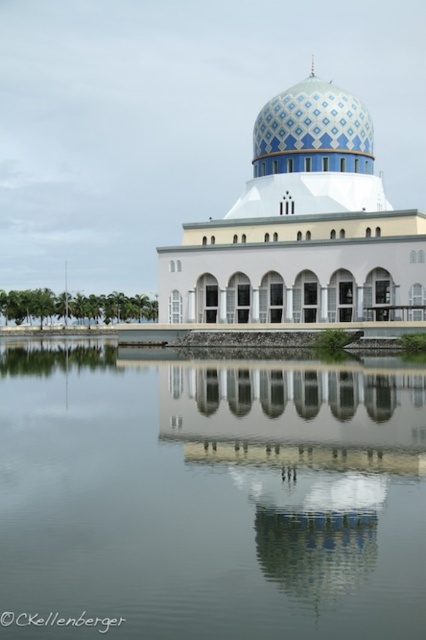
Question: Which point is farther from the camera taking this photo?

Choices:
 (A) (17, 502)
 (B) (307, 147)

Answer: (B)

Question: Is transparent glass water at center wider than blue mosaic dome at center?

Choices:
 (A) yes
 (B) no

Answer: (A)

Question: Which of the following is the farthest from the observer?

Choices:
 (A) blue mosaic dome at center
 (B) blue glossy dome at center
 (C) transparent glass water at center

Answer: (A)

Question: Can you confirm if blue glossy dome at center is bigger than blue mosaic dome at center?

Choices:
 (A) yes
 (B) no

Answer: (A)

Question: Which object is farther from the camera taking this photo?

Choices:
 (A) blue mosaic dome at center
 (B) transparent glass water at center

Answer: (A)

Question: Where is transparent glass water at center located in relation to blue mosaic dome at center in the image?

Choices:
 (A) left
 (B) right

Answer: (A)